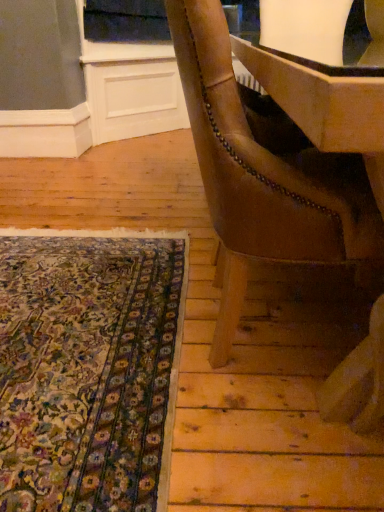
Question: Is the position of floral carpet at lower left more distant than that of leather at right?

Choices:
 (A) no
 (B) yes

Answer: (B)

Question: Does floral carpet at lower left have a lesser width compared to leather at right?

Choices:
 (A) no
 (B) yes

Answer: (A)

Question: Is floral carpet at lower left positioned with its back to leather at right?

Choices:
 (A) yes
 (B) no

Answer: (B)

Question: Is leather at right completely or partially inside floral carpet at lower left?

Choices:
 (A) no
 (B) yes

Answer: (A)

Question: From the image's perspective, is floral carpet at lower left below leather at right?

Choices:
 (A) no
 (B) yes

Answer: (B)

Question: From the image's perspective, does floral carpet at lower left appear higher than leather at right?

Choices:
 (A) no
 (B) yes

Answer: (A)

Question: Is the surface of leather at right in direct contact with floral carpet at lower left?

Choices:
 (A) yes
 (B) no

Answer: (B)

Question: Does leather at right appear on the right side of floral carpet at lower left?

Choices:
 (A) no
 (B) yes

Answer: (B)

Question: Can you confirm if leather at right is positioned to the left of floral carpet at lower left?

Choices:
 (A) no
 (B) yes

Answer: (A)

Question: From a real-world perspective, is leather at right physically below floral carpet at lower left?

Choices:
 (A) no
 (B) yes

Answer: (A)

Question: Considering the relative sizes of leather at right and floral carpet at lower left in the image provided, is leather at right bigger than floral carpet at lower left?

Choices:
 (A) yes
 (B) no

Answer: (A)

Question: Is leather at right located outside floral carpet at lower left?

Choices:
 (A) yes
 (B) no

Answer: (A)

Question: Considering the relative positions of floral carpet at lower left and leather at right in the image provided, is floral carpet at lower left to the left or to the right of leather at right?

Choices:
 (A) right
 (B) left

Answer: (B)